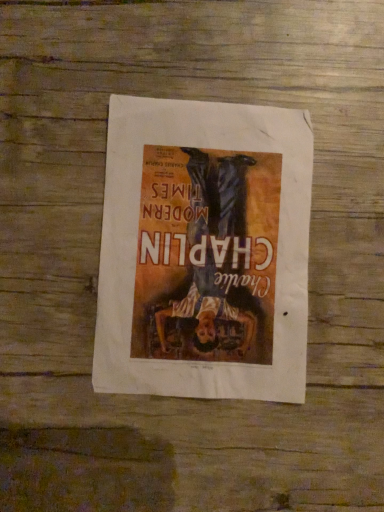
You are a GUI agent. You are given a task and a screenshot of the screen. Output one action in this format:
    pyautogui.click(x=<x>, y=<y>)
    Task: Click on the matte paper poster at center
    Image resolution: width=384 pixels, height=512 pixels.
    Given the screenshot: What is the action you would take?
    pyautogui.click(x=204, y=251)

Describe the element at coordinates (204, 251) in the screenshot. I see `matte paper poster at center` at that location.

Where is `matte paper poster at center`? The height and width of the screenshot is (512, 384). matte paper poster at center is located at coordinates (204, 251).